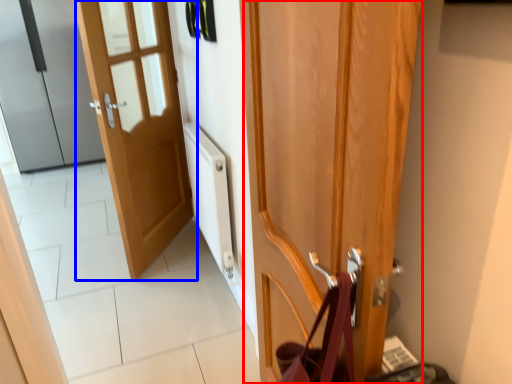
Question: Which point is further to the camera, door (highlighted by a red box) or door (highlighted by a blue box)?

Choices:
 (A) door
 (B) door

Answer: (B)